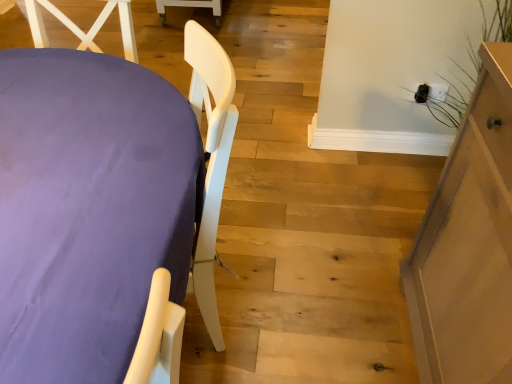
Describe the element at coordinates (89, 209) in the screenshot. I see `purple fabric-covered table at left, arranged as the 1th furniture when viewed from the left` at that location.

Find the location of `purple fabric-covered table at left, arranged as the 1th furniture when viewed from the left`. purple fabric-covered table at left, arranged as the 1th furniture when viewed from the left is located at coordinates (89, 209).

The image size is (512, 384). What do you see at coordinates (468, 244) in the screenshot?
I see `light brown wooden cabinet at right, which ranks as the second furniture in left-to-right order` at bounding box center [468, 244].

This screenshot has width=512, height=384. In order to click on light brown wooden cabinet at right, which ranks as the second furniture in left-to-right order in this screenshot , I will do `click(468, 244)`.

Where is `purple fabric-covered table at left, which ranks as the 2th furniture in right-to-left order`? purple fabric-covered table at left, which ranks as the 2th furniture in right-to-left order is located at coordinates (89, 209).

Does light brown wooden cabinet at right, acting as the first furniture starting from the right, appear on the left side of purple fabric-covered table at left, arranged as the 1th furniture when viewed from the left?

Incorrect, light brown wooden cabinet at right, acting as the first furniture starting from the right, is not on the left side of purple fabric-covered table at left, arranged as the 1th furniture when viewed from the left.

From the picture: Between light brown wooden cabinet at right, which ranks as the second furniture in left-to-right order, and purple fabric-covered table at left, arranged as the 1th furniture when viewed from the left, which one is positioned behind?

light brown wooden cabinet at right, which ranks as the second furniture in left-to-right order, is further from the camera.

Is point (469, 219) positioned before point (53, 380)?

No, it is behind (53, 380).

From the image's perspective, who appears lower, light brown wooden cabinet at right, which ranks as the second furniture in left-to-right order, or purple fabric-covered table at left, arranged as the 1th furniture when viewed from the left?

light brown wooden cabinet at right, which ranks as the second furniture in left-to-right order, appears lower in the image.

From a real-world perspective, is light brown wooden cabinet at right, which ranks as the second furniture in left-to-right order, positioned above or below purple fabric-covered table at left, arranged as the 1th furniture when viewed from the left?

In terms of real-world spatial position, light brown wooden cabinet at right, which ranks as the second furniture in left-to-right order, is above purple fabric-covered table at left, arranged as the 1th furniture when viewed from the left.

From the picture: Does light brown wooden cabinet at right, which ranks as the second furniture in left-to-right order, have a lesser width compared to purple fabric-covered table at left, arranged as the 1th furniture when viewed from the left?

Yes.

Is light brown wooden cabinet at right, acting as the first furniture starting from the right, taller than purple fabric-covered table at left, which ranks as the 2th furniture in right-to-left order?

Yes.

Considering the relative sizes of light brown wooden cabinet at right, which ranks as the second furniture in left-to-right order, and purple fabric-covered table at left, which ranks as the 2th furniture in right-to-left order, in the image provided, is light brown wooden cabinet at right, which ranks as the second furniture in left-to-right order, smaller than purple fabric-covered table at left, which ranks as the 2th furniture in right-to-left order,?

Yes.

Is light brown wooden cabinet at right, acting as the first furniture starting from the right, positioned beyond the bounds of purple fabric-covered table at left, which ranks as the 2th furniture in right-to-left order?

Indeed, light brown wooden cabinet at right, acting as the first furniture starting from the right, is completely outside purple fabric-covered table at left, which ranks as the 2th furniture in right-to-left order.

Looking at this image, is light brown wooden cabinet at right, which ranks as the second furniture in left-to-right order, with purple fabric-covered table at left, which ranks as the 2th furniture in right-to-left order?

They are not placed beside each other.

Based on the photo, is light brown wooden cabinet at right, which ranks as the second furniture in left-to-right order, oriented away from purple fabric-covered table at left, which ranks as the 2th furniture in right-to-left order?

light brown wooden cabinet at right, which ranks as the second furniture in left-to-right order, is not turned away from purple fabric-covered table at left, which ranks as the 2th furniture in right-to-left order.

Can you tell me how much light brown wooden cabinet at right, acting as the first furniture starting from the right, and purple fabric-covered table at left, arranged as the 1th furniture when viewed from the left, differ in facing direction?

The angular difference between light brown wooden cabinet at right, acting as the first furniture starting from the right, and purple fabric-covered table at left, arranged as the 1th furniture when viewed from the left, is 90.5 degrees.

You are a GUI agent. You are given a task and a screenshot of the screen. Output one action in this format:
    pyautogui.click(x=<x>, y=<y>)
    Task: Click on the furniture that appears behind the purple fabric-covered table at left, which ranks as the 2th furniture in right-to-left order
    Image resolution: width=512 pixels, height=384 pixels.
    Given the screenshot: What is the action you would take?
    pyautogui.click(x=468, y=244)

Considering the relative positions of purple fabric-covered table at left, arranged as the 1th furniture when viewed from the left, and light brown wooden cabinet at right, acting as the first furniture starting from the right, in the image provided, is purple fabric-covered table at left, arranged as the 1th furniture when viewed from the left, to the left of light brown wooden cabinet at right, acting as the first furniture starting from the right, from the viewer's perspective?

Yes, purple fabric-covered table at left, arranged as the 1th furniture when viewed from the left, is to the left of light brown wooden cabinet at right, acting as the first furniture starting from the right.

Between purple fabric-covered table at left, which ranks as the 2th furniture in right-to-left order, and light brown wooden cabinet at right, acting as the first furniture starting from the right, which one is positioned behind?

light brown wooden cabinet at right, acting as the first furniture starting from the right.

Considering the positions of points (149, 70) and (444, 200), is point (149, 70) farther from camera compared to point (444, 200)?

Yes, it is behind point (444, 200).

From the image's perspective, which object appears higher, purple fabric-covered table at left, arranged as the 1th furniture when viewed from the left, or light brown wooden cabinet at right, acting as the first furniture starting from the right?

purple fabric-covered table at left, arranged as the 1th furniture when viewed from the left.

From a real-world perspective, which is physically above, purple fabric-covered table at left, arranged as the 1th furniture when viewed from the left, or light brown wooden cabinet at right, which ranks as the second furniture in left-to-right order?

In real-world perspective, light brown wooden cabinet at right, which ranks as the second furniture in left-to-right order, is above.

Considering the sizes of objects purple fabric-covered table at left, which ranks as the 2th furniture in right-to-left order, and light brown wooden cabinet at right, which ranks as the second furniture in left-to-right order, in the image provided, who is thinner, purple fabric-covered table at left, which ranks as the 2th furniture in right-to-left order, or light brown wooden cabinet at right, which ranks as the second furniture in left-to-right order,?

Thinner between the two is light brown wooden cabinet at right, which ranks as the second furniture in left-to-right order.

Looking at this image, which of these two, purple fabric-covered table at left, arranged as the 1th furniture when viewed from the left, or light brown wooden cabinet at right, acting as the first furniture starting from the right, stands shorter?

purple fabric-covered table at left, arranged as the 1th furniture when viewed from the left.

Who is bigger, purple fabric-covered table at left, arranged as the 1th furniture when viewed from the left, or light brown wooden cabinet at right, acting as the first furniture starting from the right?

Bigger between the two is purple fabric-covered table at left, arranged as the 1th furniture when viewed from the left.

Is purple fabric-covered table at left, which ranks as the 2th furniture in right-to-left order, positioned beyond the bounds of light brown wooden cabinet at right, acting as the first furniture starting from the right?

Indeed, purple fabric-covered table at left, which ranks as the 2th furniture in right-to-left order, is completely outside light brown wooden cabinet at right, acting as the first furniture starting from the right.

Is purple fabric-covered table at left, arranged as the 1th furniture when viewed from the left, not close to light brown wooden cabinet at right, which ranks as the second furniture in left-to-right order?

No, purple fabric-covered table at left, arranged as the 1th furniture when viewed from the left, is not far away from light brown wooden cabinet at right, which ranks as the second furniture in left-to-right order.

Does purple fabric-covered table at left, which ranks as the 2th furniture in right-to-left order, turn towards light brown wooden cabinet at right, which ranks as the second furniture in left-to-right order?

No.

Can you tell me how much purple fabric-covered table at left, which ranks as the 2th furniture in right-to-left order, and light brown wooden cabinet at right, which ranks as the second furniture in left-to-right order, differ in facing direction?

They differ by 90.5 degrees in their facing directions.

You are a GUI agent. You are given a task and a screenshot of the screen. Output one action in this format:
    pyautogui.click(x=<x>, y=<y>)
    Task: Click on the furniture behind the purple fabric-covered table at left, which ranks as the 2th furniture in right-to-left order
    This screenshot has height=384, width=512.
    Given the screenshot: What is the action you would take?
    pyautogui.click(x=468, y=244)

I want to click on furniture to the left of light brown wooden cabinet at right, which ranks as the second furniture in left-to-right order, so click(x=89, y=209).

Find the location of a particular element. This screenshot has height=384, width=512. furniture that appears above the purple fabric-covered table at left, arranged as the 1th furniture when viewed from the left (from a real-world perspective) is located at coordinates (468, 244).